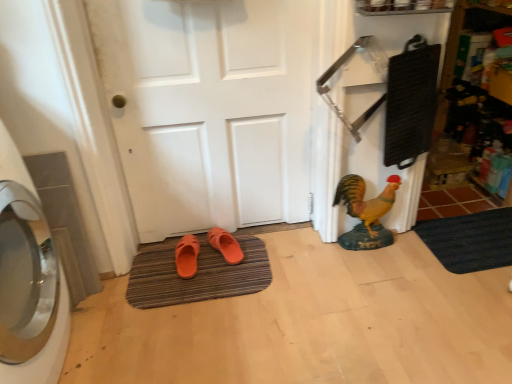
Locate an element on the screen. vacant space in front of brown striped bath mat at center, the first bath mat viewed from the left is located at coordinates (193, 341).